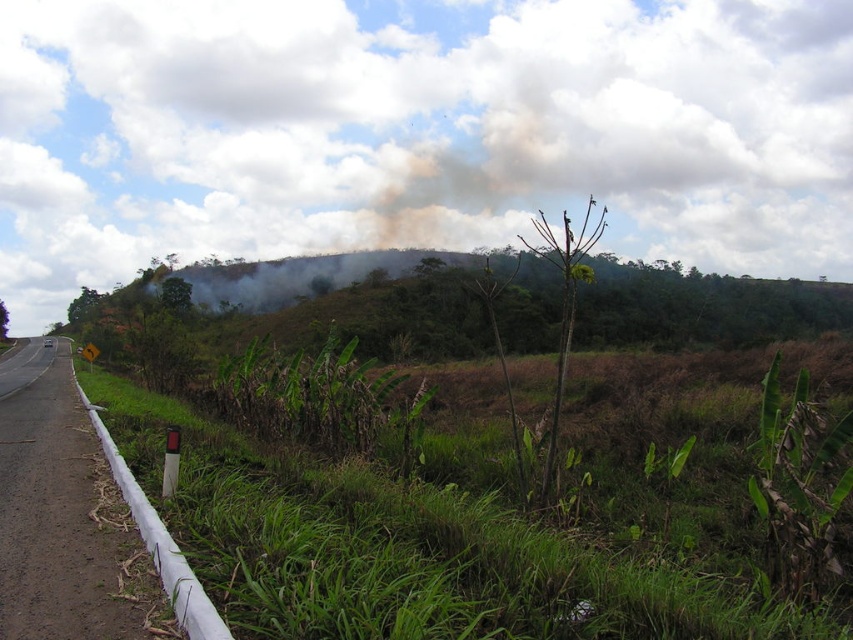
You are a hiker standing on the road and want to reach the hill beyond the green leafy vegetation at center and the white plastic barrier at left. Which object must you pass first?

You must pass the white plastic barrier at left first because it is closer to you than the green leafy vegetation at center, which is further away.